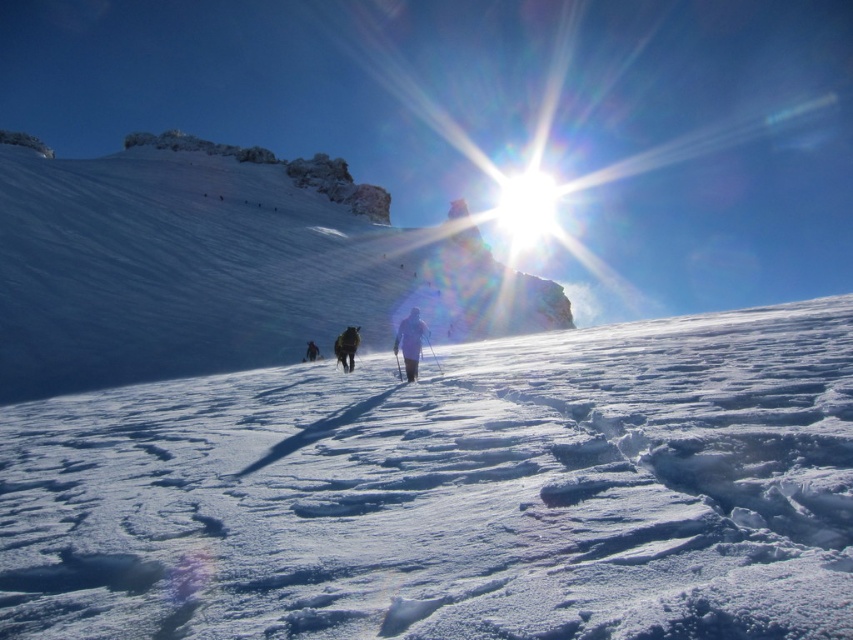
The width and height of the screenshot is (853, 640). Find the location of `matte black jacket at center`. matte black jacket at center is located at coordinates click(x=410, y=342).

You are a GUI agent. You are given a task and a screenshot of the screen. Output one action in this format:
    pyautogui.click(x=<x>, y=<y>)
    Task: Click on the matte black jacket at center
    
    Given the screenshot: What is the action you would take?
    pyautogui.click(x=410, y=342)

Looking at this image, can you confirm if white snow-covered mountain at upper center is thinner than matte black jacket at center?

No.

Between point (64, 348) and point (399, 333), which one is positioned in front?

Point (399, 333) is in front.

I want to click on white snow-covered mountain at upper center, so click(x=223, y=264).

Between white frosty snow at center and dark brown fur at center, which one is positioned lower?

dark brown fur at center

Is white frosty snow at center to the right of dark brown fur at center from the viewer's perspective?

Indeed, white frosty snow at center is positioned on the right side of dark brown fur at center.

Does point (538, 580) come farther from viewer compared to point (309, 349)?

No, (538, 580) is closer to viewer.

You are a GUI agent. You are given a task and a screenshot of the screen. Output one action in this format:
    pyautogui.click(x=<x>, y=<y>)
    Task: Click on the white frosty snow at center
    The image size is (853, 640).
    Given the screenshot: What is the action you would take?
    pyautogui.click(x=451, y=492)